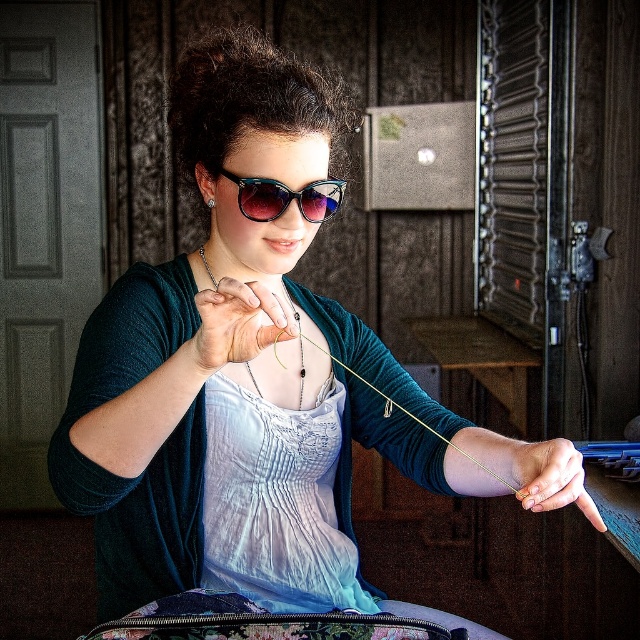
Is matte silver ring at center to the left of shiny blue acetate sunglasses at center from the viewer's perspective?

Correct, you'll find matte silver ring at center to the left of shiny blue acetate sunglasses at center.

Does matte silver ring at center lie in front of shiny blue acetate sunglasses at center?

Yes, it is.

Between point (260, 292) and point (324, 195), which one is positioned behind?

Positioned behind is point (324, 195).

This screenshot has width=640, height=640. What are the coordinates of `matte silver ring at center` in the screenshot? It's located at (237, 323).

This screenshot has width=640, height=640. What do you see at coordinates (550, 477) in the screenshot? I see `gold metallic ring at lower right` at bounding box center [550, 477].

How distant is gold metallic ring at lower right from shiny blue acetate sunglasses at center?

A distance of 16.83 inches exists between gold metallic ring at lower right and shiny blue acetate sunglasses at center.

Locate an element on the screen. gold metallic ring at lower right is located at coordinates (550, 477).

Find the location of a particular element. Image resolution: width=640 pixels, height=640 pixels. gold metallic ring at lower right is located at coordinates (550, 477).

Can you confirm if white cotton apron at center is smaller than gold metallic ring at lower right?

Actually, white cotton apron at center might be larger than gold metallic ring at lower right.

Between white cotton apron at center and gold metallic ring at lower right, which one is positioned lower?

Positioned lower is white cotton apron at center.

Is point (244, 534) closer to viewer compared to point (540, 509)?

No, it is behind (540, 509).

Identify the location of white cotton apron at center. (276, 500).